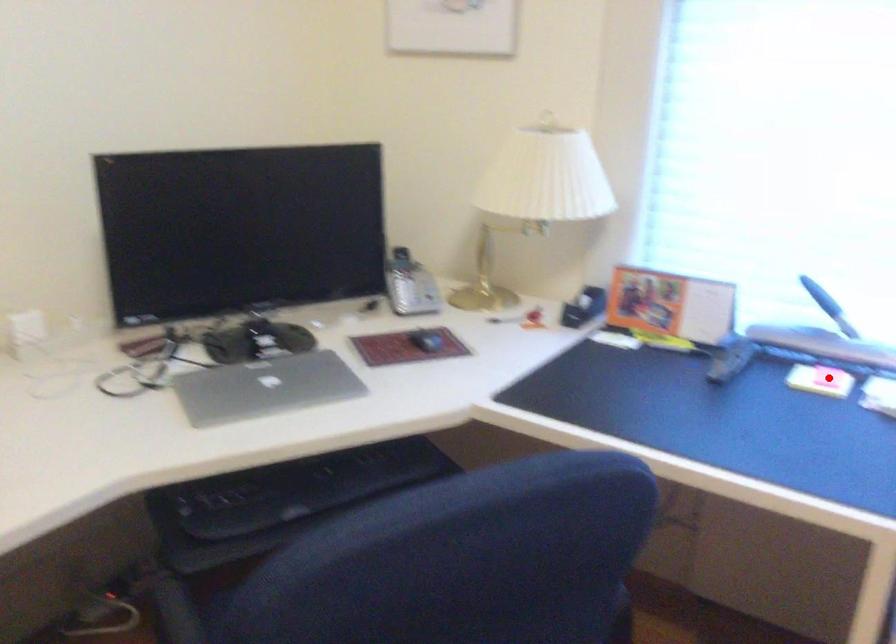
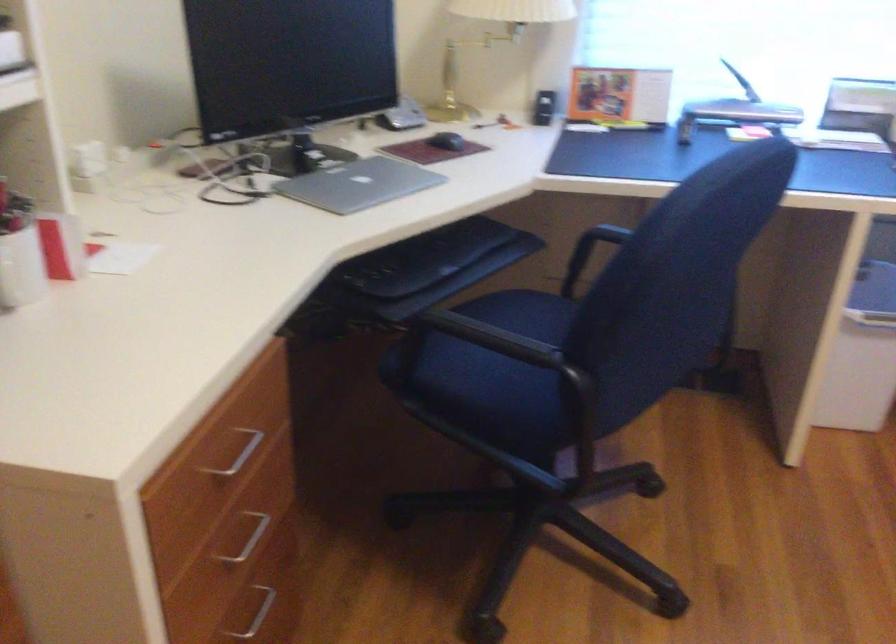
Question: I am providing you with two images of the same scene from different viewpoints. A red point is marked on the first image. At the location where the point appears in image 1, is it still visible in image 2?

Choices:
 (A) Yes
 (B) No

Answer: (B)